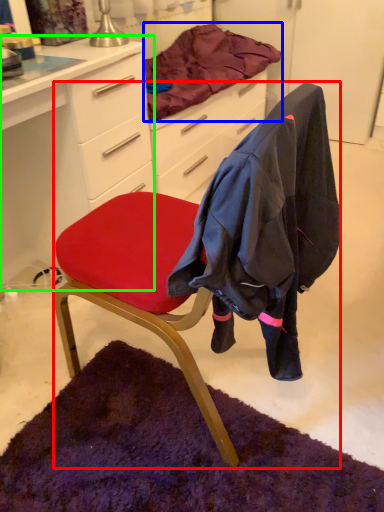
Question: Considering the real-world distances, which object is closest to chair (highlighted by a red box)? blanket (highlighted by a blue box) or desk (highlighted by a green box).

Choices:
 (A) blanket
 (B) desk

Answer: (B)